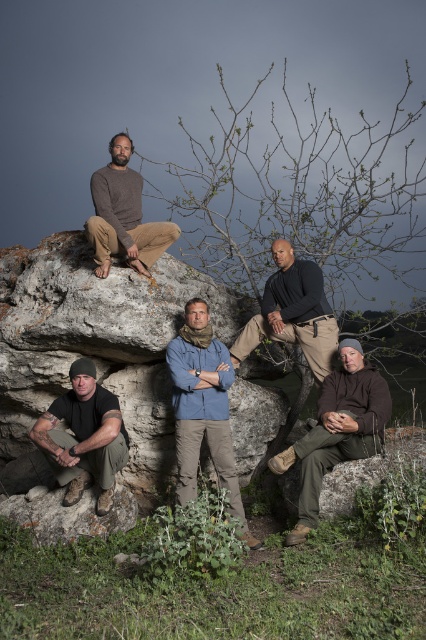
Is brown woolen sweater at lower right thinner than matte brown pants at upper center?

No.

What are the coordinates of `brown woolen sweater at lower right` in the screenshot? It's located at (336, 429).

Measure the distance between brown woolen sweater at lower right and camera.

4.70 meters

You are a GUI agent. You are given a task and a screenshot of the screen. Output one action in this format:
    pyautogui.click(x=<x>, y=<y>)
    Task: Click on the brown woolen sweater at lower right
    
    Given the screenshot: What is the action you would take?
    pyautogui.click(x=336, y=429)

This screenshot has height=640, width=426. What do you see at coordinates (203, 406) in the screenshot? I see `blue fabric shirt at center` at bounding box center [203, 406].

Is blue fabric shirt at center thinner than matte black t-shirt at lower left?

Correct, blue fabric shirt at center's width is less than matte black t-shirt at lower left's.

At what (x,y) coordinates should I click in order to perform the action: click on blue fabric shirt at center. Please return your answer as a coordinate pair (x, y). The image size is (426, 640). Looking at the image, I should click on (203, 406).

Where is `blue fabric shirt at center`? Image resolution: width=426 pixels, height=640 pixels. blue fabric shirt at center is located at coordinates (203, 406).

Is brown woolen sweater at lower right to the right of matte black t-shirt at lower left from the viewer's perspective?

Indeed, brown woolen sweater at lower right is positioned on the right side of matte black t-shirt at lower left.

Between brown woolen sweater at lower right and matte black t-shirt at lower left, which one is positioned higher?

brown woolen sweater at lower right is above.

Describe the element at coordinates (336, 429) in the screenshot. I see `brown woolen sweater at lower right` at that location.

The image size is (426, 640). Identify the location of brown woolen sweater at lower right. (336, 429).